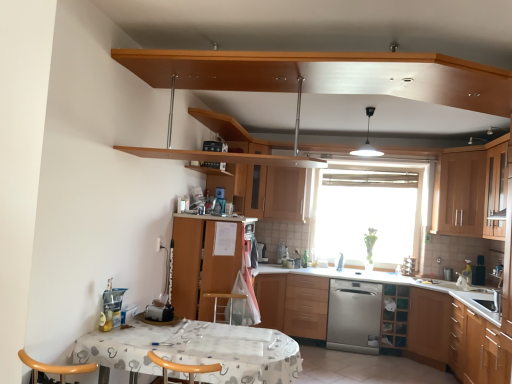
Question: Is wooden cabinet at right, the 4th cabinetry positioned from the left, to the left or to the right of wooden cabinet at upper center, which is the 1th shelf from top to bottom, in the image?

Choices:
 (A) right
 (B) left

Answer: (A)

Question: In terms of size, does wooden cabinet at right, the 4th cabinetry positioned from the left, appear bigger or smaller than wooden cabinet at upper center, which is the first shelf in front-to-back order?

Choices:
 (A) big
 (B) small

Answer: (A)

Question: Which is nearer to the wooden cabinet at upper right, the 1th cabinetry positioned from the right?

Choices:
 (A) wooden cabinet at center, the 5th cabinetry in the right-to-left sequence
 (B) wooden cabinet at right, the 5th cabinetry from the left
 (C) wooden cabinet at lower center, acting as the 3th cabinetry starting from the left
 (D) wooden cabinet at center, arranged as the 6th cabinetry when viewed from the right
 (E) wooden shelf at lower right, marked as the second shelf in a left-to-right arrangement

Answer: (B)

Question: Which object is positioned farthest from the wooden cabinet at lower center, acting as the 3th cabinetry starting from the left?

Choices:
 (A) white fabric-covered table at lower center
 (B) satin silver dishwasher at center
 (C) wooden cabinet at right, which ranks as the second cabinetry in right-to-left order
 (D) transparent glass window at center
 (E) wooden cabinet at upper center, which is the first shelf in front-to-back order

Answer: (A)